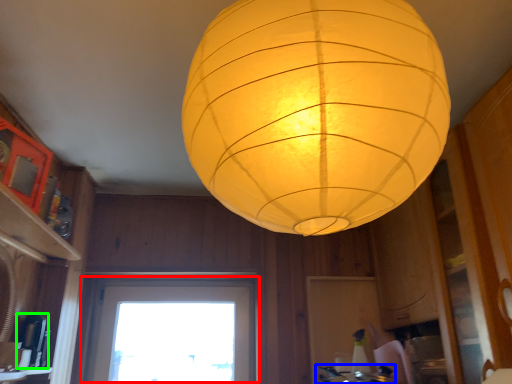
Question: Which object is the farthest from window (highlighted by a red box)? Choose among these: gas stove (highlighted by a blue box) or appliance (highlighted by a green box).

Choices:
 (A) gas stove
 (B) appliance

Answer: (A)